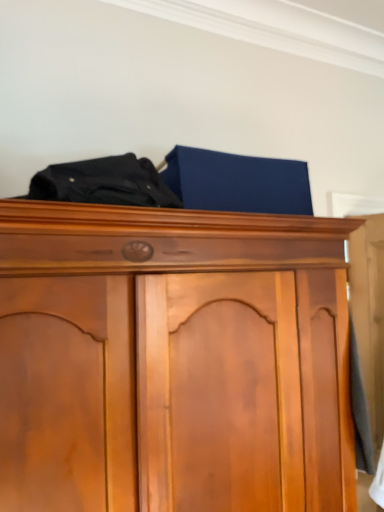
Locate an element on the screen. This screenshot has width=384, height=512. wooden wardrobe at upper center is located at coordinates (193, 279).

Describe the element at coordinates (193, 279) in the screenshot. The height and width of the screenshot is (512, 384). I see `wooden wardrobe at upper center` at that location.

This screenshot has height=512, width=384. What do you see at coordinates (104, 183) in the screenshot? I see `black fabric at upper center` at bounding box center [104, 183].

Locate an element on the screen. black fabric at upper center is located at coordinates (104, 183).

In order to face black fabric at upper center, should I rotate leftwards or rightwards?

To align with it, rotate left about 10.988°.

The height and width of the screenshot is (512, 384). In order to click on wooden wardrobe at upper center in this screenshot , I will do `click(193, 279)`.

Which object is positioned more to the right, wooden wardrobe at upper center or black fabric at upper center?

Positioned to the right is wooden wardrobe at upper center.

Considering their positions, is wooden wardrobe at upper center located in front of or behind black fabric at upper center?

wooden wardrobe at upper center is in front of black fabric at upper center.

Which is behind, point (335, 281) or point (173, 199)?

Point (335, 281)

From the image's perspective, which is below, wooden wardrobe at upper center or black fabric at upper center?

wooden wardrobe at upper center appears lower in the image.

From a real-world perspective, who is located lower, wooden wardrobe at upper center or black fabric at upper center?

From a 3D spatial view, wooden wardrobe at upper center is below.

Is wooden wardrobe at upper center thinner than black fabric at upper center?

No.

Based on the photo, considering the sizes of wooden wardrobe at upper center and black fabric at upper center in the image, is wooden wardrobe at upper center taller or shorter than black fabric at upper center?

wooden wardrobe at upper center is taller than black fabric at upper center.

Between wooden wardrobe at upper center and black fabric at upper center, which one has larger size?

wooden wardrobe at upper center.

Is wooden wardrobe at upper center inside or outside of black fabric at upper center?

wooden wardrobe at upper center is outside black fabric at upper center.

Is wooden wardrobe at upper center not near black fabric at upper center?

wooden wardrobe at upper center is actually quite close to black fabric at upper center.

Could you tell me if wooden wardrobe at upper center is turned towards black fabric at upper center?

No, wooden wardrobe at upper center does not turn towards black fabric at upper center.

How different are the orientations of wooden wardrobe at upper center and black fabric at upper center in degrees?

The angular difference between wooden wardrobe at upper center and black fabric at upper center is 22.3 degrees.

Locate an element on the screen. underclothes above the wooden wardrobe at upper center (from the image's perspective) is located at coordinates (104, 183).

From the picture: Which object is positioned more to the left, black fabric at upper center or wooden wardrobe at upper center?

Positioned to the left is black fabric at upper center.

Relative to wooden wardrobe at upper center, is black fabric at upper center in front or behind?

Visually, black fabric at upper center is located behind wooden wardrobe at upper center.

Which is in front, point (84, 162) or point (222, 255)?

The point (84, 162) is closer.

From the image's perspective, is black fabric at upper center located above wooden wardrobe at upper center?

Correct, black fabric at upper center appears higher than wooden wardrobe at upper center in the image.

From a real-world perspective, does black fabric at upper center sit lower than wooden wardrobe at upper center?

No, from a real-world perspective, black fabric at upper center is not below wooden wardrobe at upper center.

Looking at their sizes, would you say black fabric at upper center is wider or thinner than wooden wardrobe at upper center?

black fabric at upper center is thinner than wooden wardrobe at upper center.

Considering the relative sizes of black fabric at upper center and wooden wardrobe at upper center in the image provided, is black fabric at upper center taller than wooden wardrobe at upper center?

No, black fabric at upper center is not taller than wooden wardrobe at upper center.

Can you confirm if black fabric at upper center is smaller than wooden wardrobe at upper center?

Indeed, black fabric at upper center has a smaller size compared to wooden wardrobe at upper center.

Is wooden wardrobe at upper center inside black fabric at upper center?

Definitely not — wooden wardrobe at upper center is not inside black fabric at upper center.

Is black fabric at upper center touching wooden wardrobe at upper center?

They are not placed beside each other.

Does black fabric at upper center turn towards wooden wardrobe at upper center?

No, black fabric at upper center is not facing towards wooden wardrobe at upper center.

How different are the orientations of black fabric at upper center and wooden wardrobe at upper center in degrees?

The angle between the facing direction of black fabric at upper center and the facing direction of wooden wardrobe at upper center is 22.3 degrees.

How distant is black fabric at upper center from wooden wardrobe at upper center?

black fabric at upper center is 28.73 centimeters from wooden wardrobe at upper center.

This screenshot has width=384, height=512. In order to click on cupboard lying below the black fabric at upper center (from the image's perspective) in this screenshot , I will do `click(193, 279)`.

At what (x,y) coordinates should I click in order to perform the action: click on underclothes above the wooden wardrobe at upper center (from the image's perspective). Please return your answer as a coordinate pair (x, y). The width and height of the screenshot is (384, 512). Looking at the image, I should click on (104, 183).

The image size is (384, 512). Identify the location of underclothes on the left of the wooden wardrobe at upper center. (104, 183).